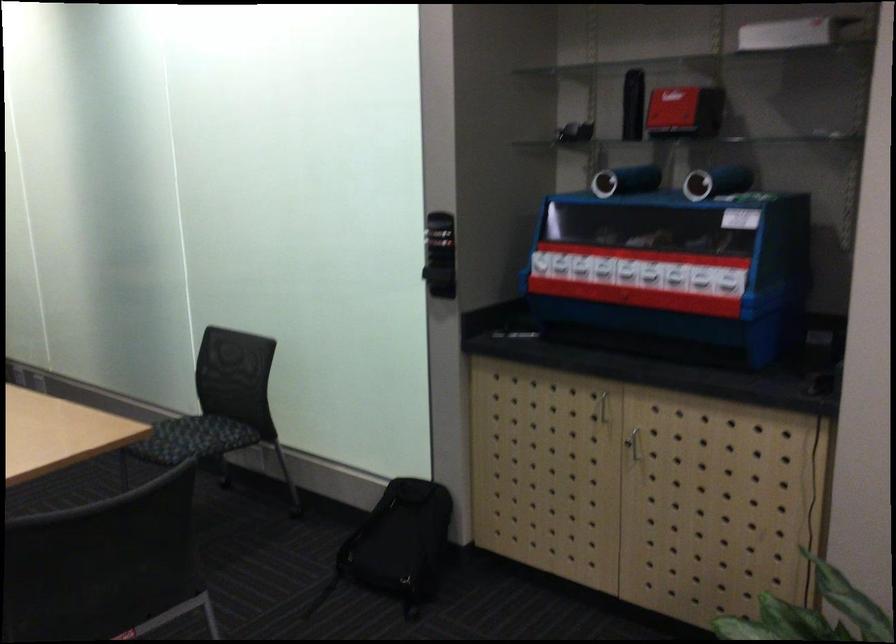
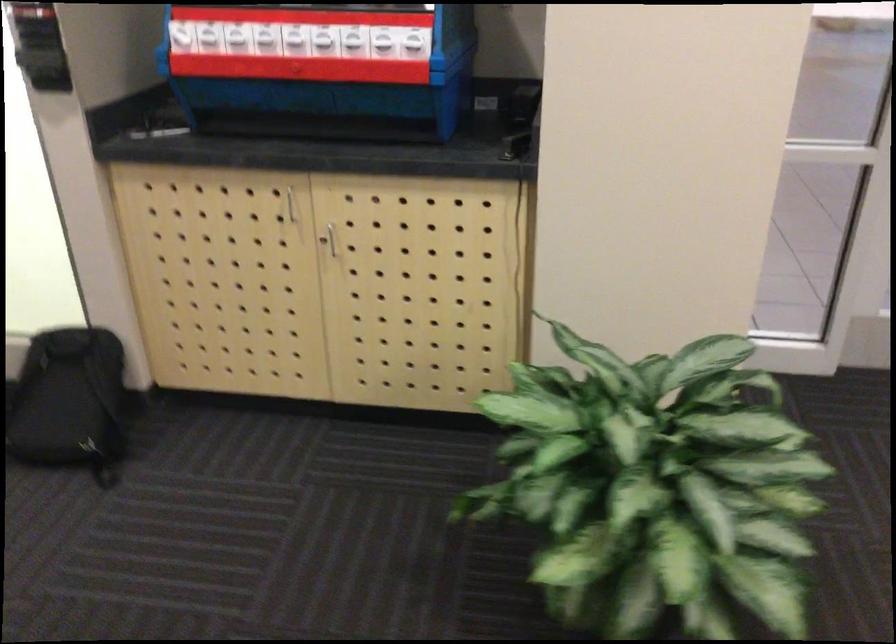
Question: The camera is either moving clockwise (left) or counter-clockwise (right) around the object. The first image is from the beginning of the video and the second image is from the end. Is the camera moving left or right when shooting the video?

Choices:
 (A) Left
 (B) Right

Answer: (A)